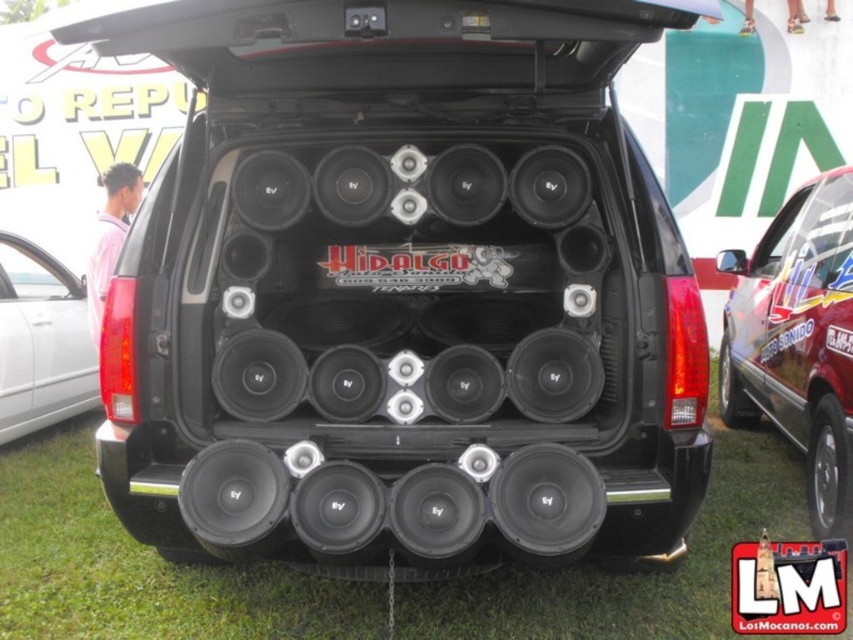
Question: Can you confirm if shiny metallic car at right is positioned to the left of black matte speaker at lower left?

Choices:
 (A) yes
 (B) no

Answer: (B)

Question: Which is farther from the black matte speaker at lower left?

Choices:
 (A) green grass at lower center
 (B) black plastic license plate at center

Answer: (B)

Question: Which is nearer to the black matte speaker at lower left?

Choices:
 (A) black plastic license plate at center
 (B) shiny metallic car at right
 (C) green grass at lower center

Answer: (C)

Question: Does green grass at lower center have a lesser width compared to black matte speaker at lower left?

Choices:
 (A) no
 (B) yes

Answer: (A)

Question: Which of the following is the farthest from the observer?

Choices:
 (A) black plastic license plate at center
 (B) shiny metallic car at right
 (C) black matte speaker at lower left

Answer: (C)

Question: Can you confirm if green grass at lower center is smaller than black matte speaker at lower left?

Choices:
 (A) yes
 (B) no

Answer: (A)